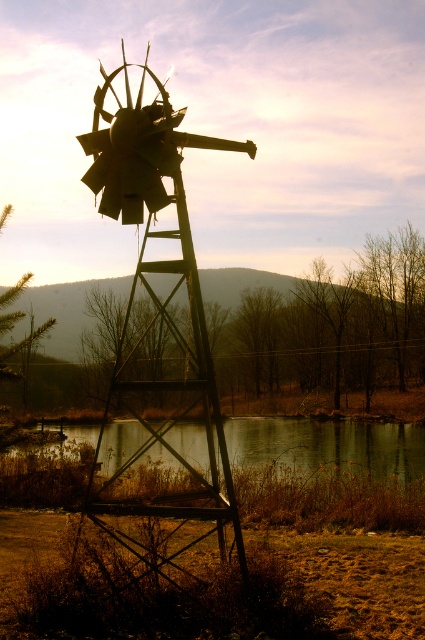
You are standing at the edge of the smooth reflective water at lower center and want to look at the rusty metal windmill at center. In which direction should you turn your head to see it?

The rusty metal windmill at center is in front of smooth reflective water at lower center, so you should look straight ahead to see it.